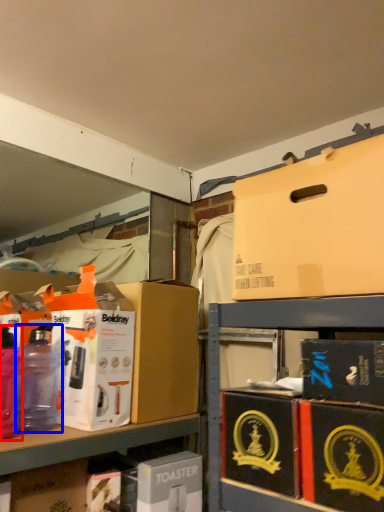
Question: Which object appears closest to the camera in this image, bottle (highlighted by a red box) or bottle (highlighted by a blue box)?

Choices:
 (A) bottle
 (B) bottle

Answer: (A)